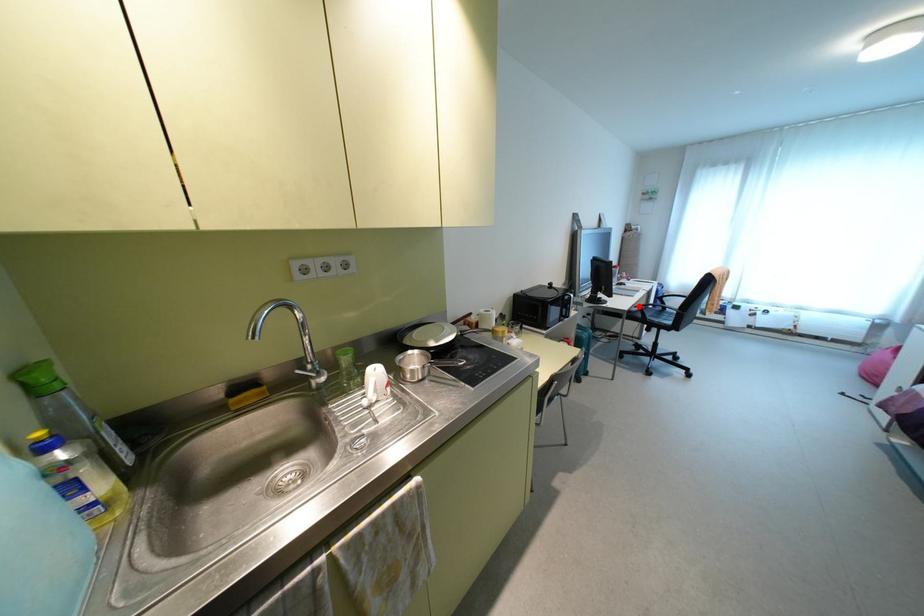
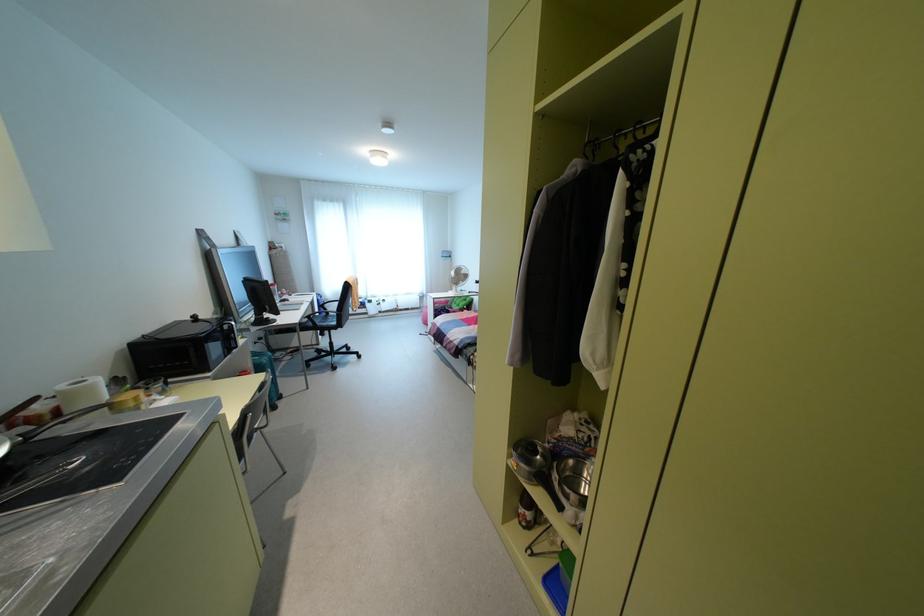
In the second image, find the point that corresponds to the highlighted location in the first image.

(309, 315)